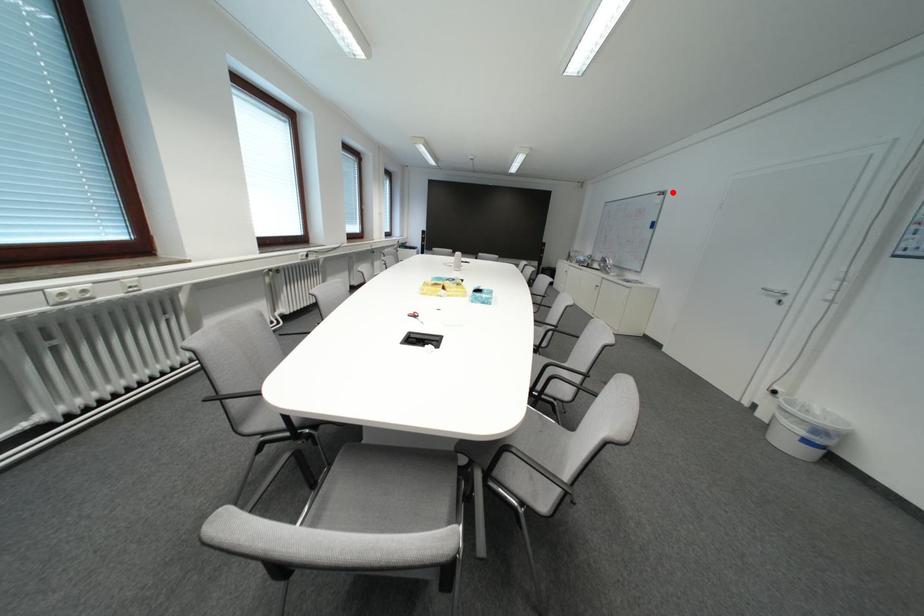
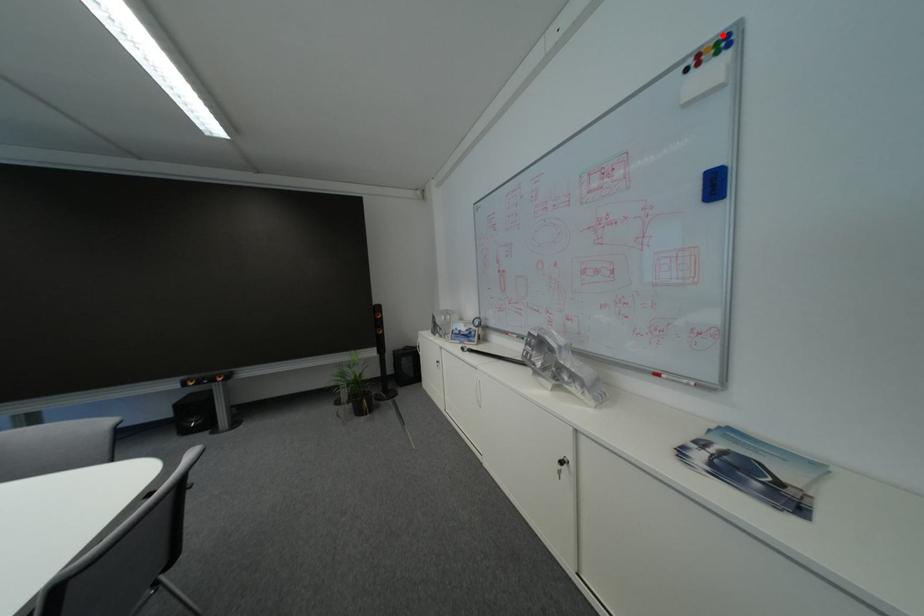
I am providing you with two images of the same scene from different viewpoints. A red point is marked on the first image and another point is marked on the second image. Are the points marked in image1 and image2 representing the same 3D position?

Yes